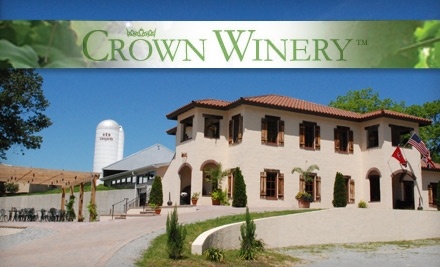
Where is `green plants bottom center`? The width and height of the screenshot is (440, 267). green plants bottom center is located at coordinates (249, 246), (174, 243), (216, 253).